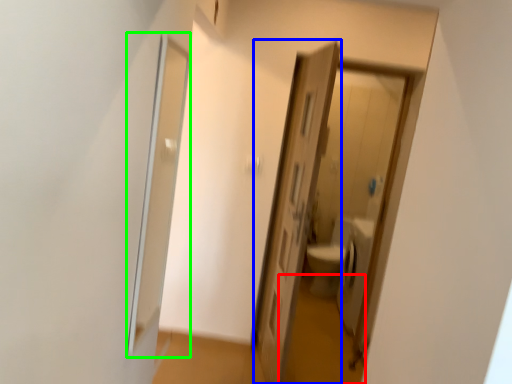
Question: Which is nearer to the path (highlighted by a red box)? door (highlighted by a blue box) or screen door (highlighted by a green box).

Choices:
 (A) door
 (B) screen door

Answer: (A)